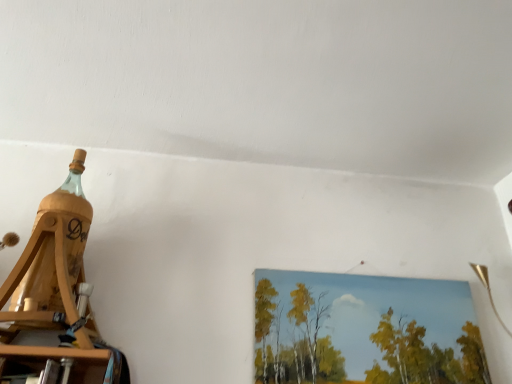
Locate an element on the screen. wooden picture frame at upper right is located at coordinates (365, 330).

The height and width of the screenshot is (384, 512). Describe the element at coordinates (365, 330) in the screenshot. I see `wooden picture frame at upper right` at that location.

Locate an element on the screen. This screenshot has height=384, width=512. wooden bottle at left is located at coordinates (55, 299).

Measure the distance between point (4,341) and camera.

The depth of point (4,341) is 3.35 feet.

Image resolution: width=512 pixels, height=384 pixels. What do you see at coordinates (55, 299) in the screenshot? I see `wooden bottle at left` at bounding box center [55, 299].

Identify the location of wooden picture frame at upper right. (365, 330).

Between wooden picture frame at upper right and wooden bottle at left, which one appears on the left side from the viewer's perspective?

wooden bottle at left.

Is the position of wooden picture frame at upper right more distant than that of wooden bottle at left?

Yes, wooden picture frame at upper right is further from the viewer.

Which is closer, (x=309, y=336) or (x=60, y=280)?

Point (x=309, y=336) is positioned farther from the camera compared to point (x=60, y=280).

From the image's perspective, is wooden picture frame at upper right on top of wooden bottle at left?

Actually, wooden picture frame at upper right appears below wooden bottle at left in the image.

From a real-world perspective, between wooden picture frame at upper right and wooden bottle at left, who is vertically higher?

wooden bottle at left.

Is wooden picture frame at upper right thinner than wooden bottle at left?

Indeed, wooden picture frame at upper right has a lesser width compared to wooden bottle at left.

Considering the relative sizes of wooden picture frame at upper right and wooden bottle at left in the image provided, is wooden picture frame at upper right shorter than wooden bottle at left?

Yes.

Who is bigger, wooden picture frame at upper right or wooden bottle at left?

Bigger between the two is wooden bottle at left.

Looking at this image, would you say wooden picture frame at upper right contains wooden bottle at left?

No, wooden bottle at left is not a part of wooden picture frame at upper right.

Is wooden picture frame at upper right far from wooden bottle at left?

No, wooden picture frame at upper right is not far from wooden bottle at left.

Is wooden bottle at left at the back of wooden picture frame at upper right?

No, wooden picture frame at upper right is not facing away from wooden bottle at left.

How different are the orientations of wooden picture frame at upper right and wooden bottle at left in degrees?

wooden picture frame at upper right and wooden bottle at left are facing 0.277 degrees away from each other.

How much distance is there between wooden picture frame at upper right and wooden bottle at left?

wooden picture frame at upper right is 56.35 centimeters from wooden bottle at left.

Identify the location of bottle that is in front of the wooden picture frame at upper right. (55, 299).

Is wooden bottle at left to the left of wooden picture frame at upper right from the viewer's perspective?

Yes.

In the image, is wooden bottle at left positioned in front of or behind wooden picture frame at upper right?

wooden bottle at left is in front of wooden picture frame at upper right.

Between point (56, 358) and point (338, 289), which one is positioned behind?

Positioned behind is point (338, 289).

From the image's perspective, who appears lower, wooden bottle at left or wooden picture frame at upper right?

wooden picture frame at upper right appears lower in the image.

From a real-world perspective, does wooden bottle at left stand above wooden picture frame at upper right?

Yes.

Can you confirm if wooden bottle at left is thinner than wooden picture frame at upper right?

No, wooden bottle at left is not thinner than wooden picture frame at upper right.

Which of these two, wooden bottle at left or wooden picture frame at upper right, stands shorter?

wooden picture frame at upper right is shorter.

Considering the sizes of wooden bottle at left and wooden picture frame at upper right in the image, is wooden bottle at left bigger or smaller than wooden picture frame at upper right?

Clearly, wooden bottle at left is larger in size than wooden picture frame at upper right.

Is wooden bottle at left positioned beyond the bounds of wooden picture frame at upper right?

Yes.

Would you say wooden bottle at left is a long distance from wooden picture frame at upper right?

No, wooden bottle at left is not far from wooden picture frame at upper right.

Is wooden bottle at left aimed at wooden picture frame at upper right?

No, wooden bottle at left is not aimed at wooden picture frame at upper right.

You are a GUI agent. You are given a task and a screenshot of the screen. Output one action in this format:
    pyautogui.click(x=<x>, y=<y>)
    Task: Click on the bottle above the wooden picture frame at upper right (from a real-world perspective)
    Image resolution: width=512 pixels, height=384 pixels.
    Given the screenshot: What is the action you would take?
    pyautogui.click(x=55, y=299)

Locate an element on the screen. This screenshot has height=384, width=512. picture frame located below the wooden bottle at left (from the image's perspective) is located at coordinates (365, 330).

Locate an element on the screen. picture frame below the wooden bottle at left (from a real-world perspective) is located at coordinates (365, 330).